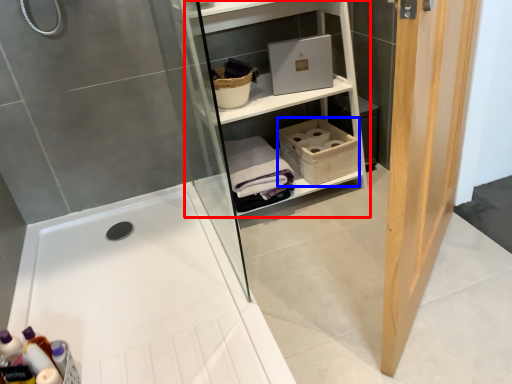
Question: Among these objects, which one is nearest to the camera, shelf (highlighted by a red box) or basket (highlighted by a blue box)?

Choices:
 (A) shelf
 (B) basket

Answer: (A)